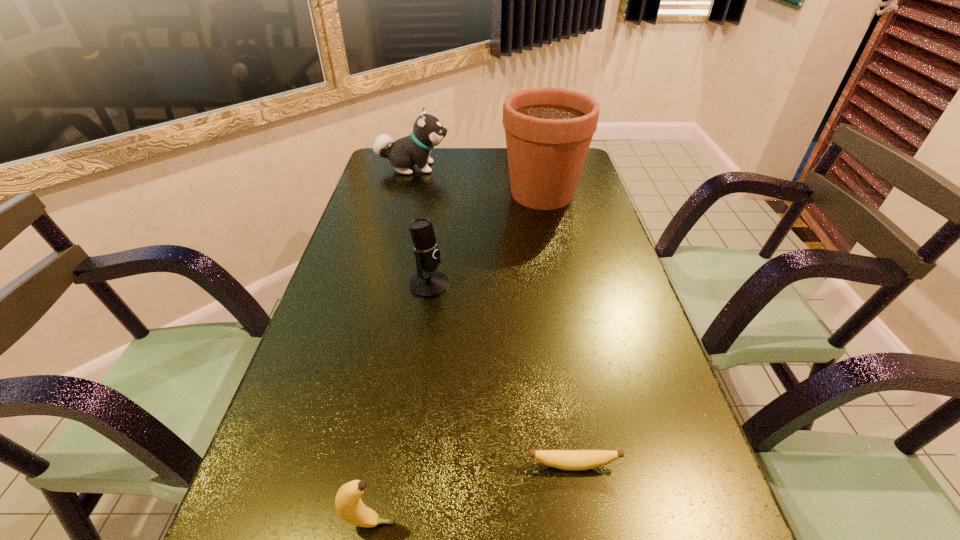
The image size is (960, 540). Identify the location of free spot that satisfies the following two spatial constraints: 1. at the face of the puppy; 2. on the right side of the right banana. (340, 465).